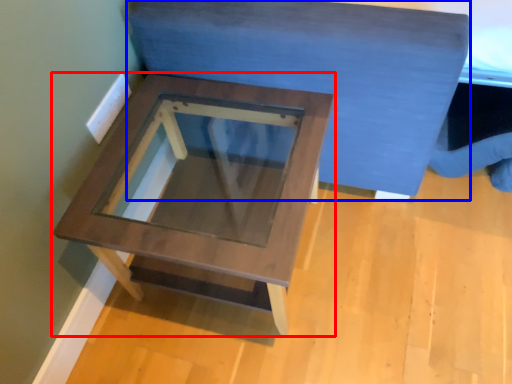
Question: Which of the following is the closest to the observer, table (highlighted by a red box) or bedding (highlighted by a blue box)?

Choices:
 (A) table
 (B) bedding

Answer: (B)